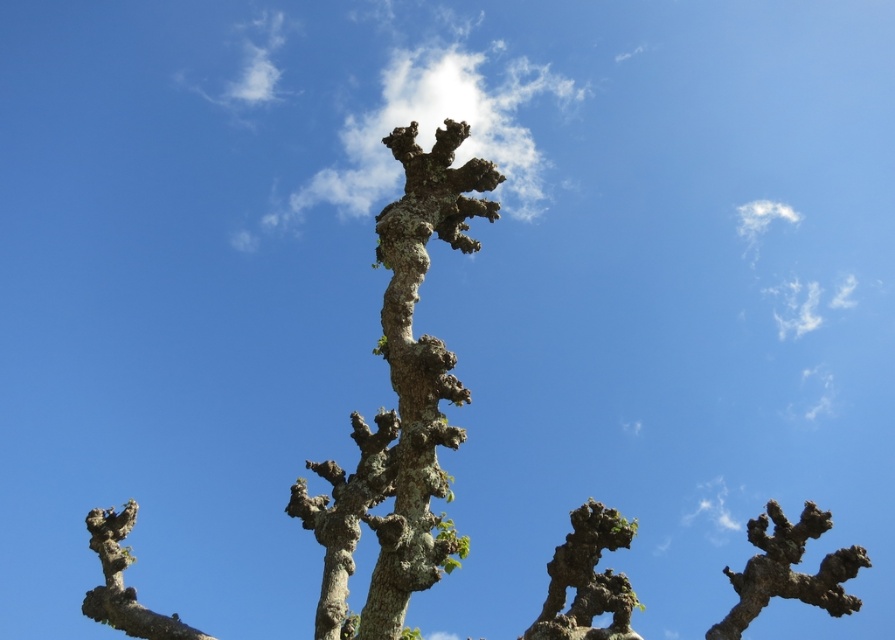
Question: Which of the following is the closest to the observer?

Choices:
 (A) lichen-covered bark tree at center
 (B) barky brown branch at center

Answer: (A)

Question: Is green mossy tree trunk at center above barky brown branch at center?

Choices:
 (A) no
 (B) yes

Answer: (B)

Question: Does green mossy tree trunk at center lie in front of barky brown branch at center?

Choices:
 (A) yes
 (B) no

Answer: (A)

Question: Is green mossy tree trunk at center bigger than barky brown branch at center?

Choices:
 (A) yes
 (B) no

Answer: (B)

Question: Which object appears closest to the camera in this image?

Choices:
 (A) barky brown branch at center
 (B) lichen-covered bark tree at center

Answer: (B)

Question: Among these points, which one is nearest to the camera?

Choices:
 (A) (374, 454)
 (B) (456, 552)
 (C) (770, 554)

Answer: (B)